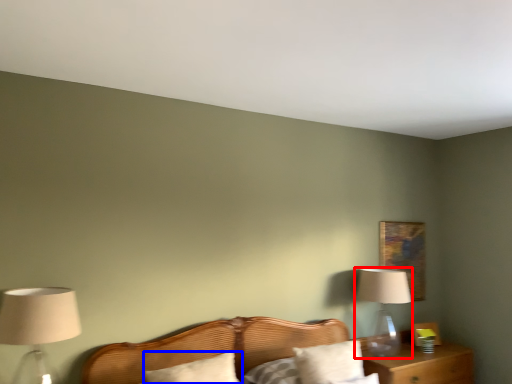
Question: Which of the following is the closest to the observer, table lamp (highlighted by a red box) or pillow (highlighted by a blue box)?

Choices:
 (A) table lamp
 (B) pillow

Answer: (B)